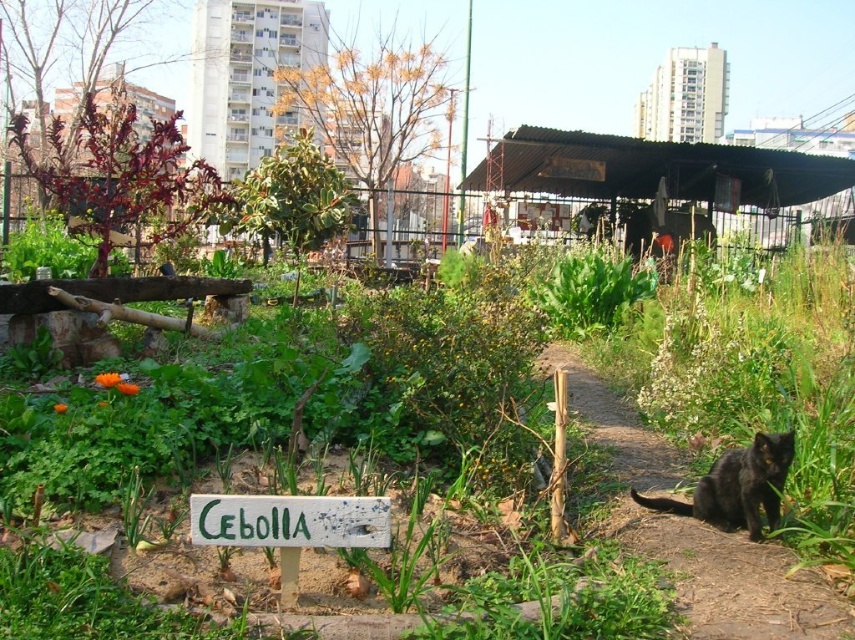
Question: Which point is closer to the camera taking this photo?

Choices:
 (A) (694, 506)
 (B) (782, 600)

Answer: (B)

Question: Considering the relative positions of green painted wood sign at center and black fur cat at lower right in the image provided, where is green painted wood sign at center located with respect to black fur cat at lower right?

Choices:
 (A) below
 (B) above

Answer: (B)

Question: Estimate the real-world distances between objects in this image. Which object is farther from the green painted wood sign at center?

Choices:
 (A) dirt path at center
 (B) black fur cat at lower right

Answer: (B)

Question: Which point is farther to the camera?

Choices:
 (A) (758, 458)
 (B) (694, 618)
 (C) (299, 522)

Answer: (A)

Question: Does green painted wood sign at center appear under black fur cat at lower right?

Choices:
 (A) yes
 (B) no

Answer: (B)

Question: Can you confirm if dirt path at center is bigger than green painted wood sign at center?

Choices:
 (A) yes
 (B) no

Answer: (A)